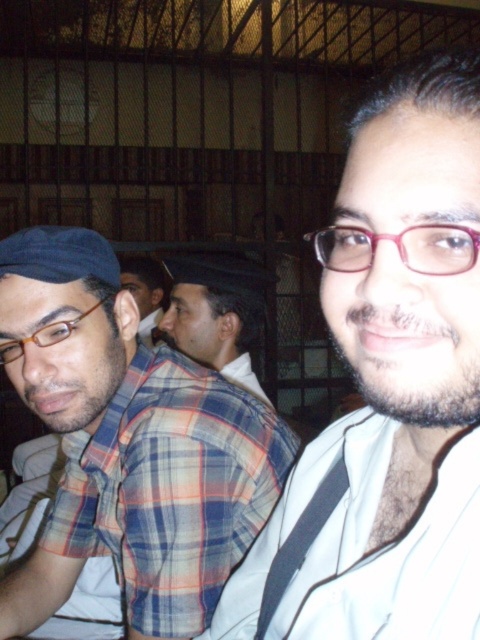
In the scene shown: Does white matte shirt at center have a lesser height compared to plaid fabric shirt at left?

No, white matte shirt at center is not shorter than plaid fabric shirt at left.

From the picture: Measure the distance between white matte shirt at center and camera.

A distance of 33.97 centimeters exists between white matte shirt at center and camera.

Describe the element at coordinates (388, 388) in the screenshot. I see `white matte shirt at center` at that location.

At what (x,y) coordinates should I click in order to perform the action: click on white matte shirt at center. Please return your answer as a coordinate pair (x, y). This screenshot has width=480, height=640. Looking at the image, I should click on (x=388, y=388).

Does plaid fabric shirt at left appear on the left side of plaid shirt at center?

Incorrect, plaid fabric shirt at left is not on the left side of plaid shirt at center.

Does point (180, 404) lie behind point (139, 276)?

That is False.

At what (x,y) coordinates should I click in order to perform the action: click on plaid fabric shirt at left. Please return your answer as a coordinate pair (x, y). The image size is (480, 640). Looking at the image, I should click on (170, 488).

The width and height of the screenshot is (480, 640). I want to click on plaid fabric shirt at left, so click(170, 488).

Who is positioned more to the right, white matte shirt at center or plaid shirt at center?

white matte shirt at center is more to the right.

Which of these two, white matte shirt at center or plaid shirt at center, stands shorter?

plaid shirt at center

The image size is (480, 640). What do you see at coordinates (388, 388) in the screenshot? I see `white matte shirt at center` at bounding box center [388, 388].

Where is `white matte shirt at center`? This screenshot has height=640, width=480. white matte shirt at center is located at coordinates (388, 388).